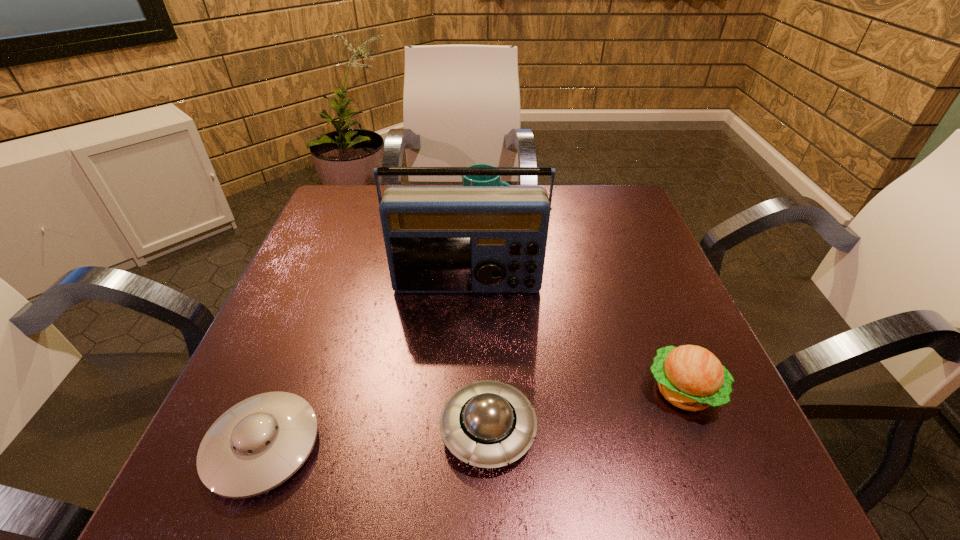
You are a GUI agent. You are given a task and a screenshot of the screen. Output one action in this format:
    pyautogui.click(x=<x>, y=<y>)
    Task: Click on the vacant space that satisfies the following two spatial constraints: 1. on the handle side of the third tallest object; 2. on the right side of the cup
    
    Given the screenshot: What is the action you would take?
    pyautogui.click(x=492, y=391)

Identify the location of free location that satisfies the following two spatial constraints: 1. on the front panel of the fourth nearest object; 2. on the right side of the rightmost object. The width and height of the screenshot is (960, 540). (464, 391).

Locate an element on the screen. This screenshot has width=960, height=540. vacant space that satisfies the following two spatial constraints: 1. on the back side of the taller saucer; 2. on the right side of the hamburger is located at coordinates (488, 391).

You are a GUI agent. You are given a task and a screenshot of the screen. Output one action in this format:
    pyautogui.click(x=<x>, y=<y>)
    Task: Click on the vacant area that satisfies the following two spatial constraints: 1. on the back side of the hamburger; 2. on the right side of the right saucer
    The height and width of the screenshot is (540, 960).
    Given the screenshot: What is the action you would take?
    pyautogui.click(x=488, y=391)